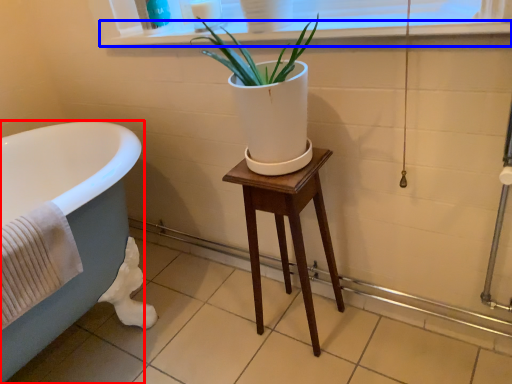
Question: Which object appears farthest to the camera in this image, bathtub (highlighted by a red box) or window sill (highlighted by a blue box)?

Choices:
 (A) bathtub
 (B) window sill

Answer: (A)